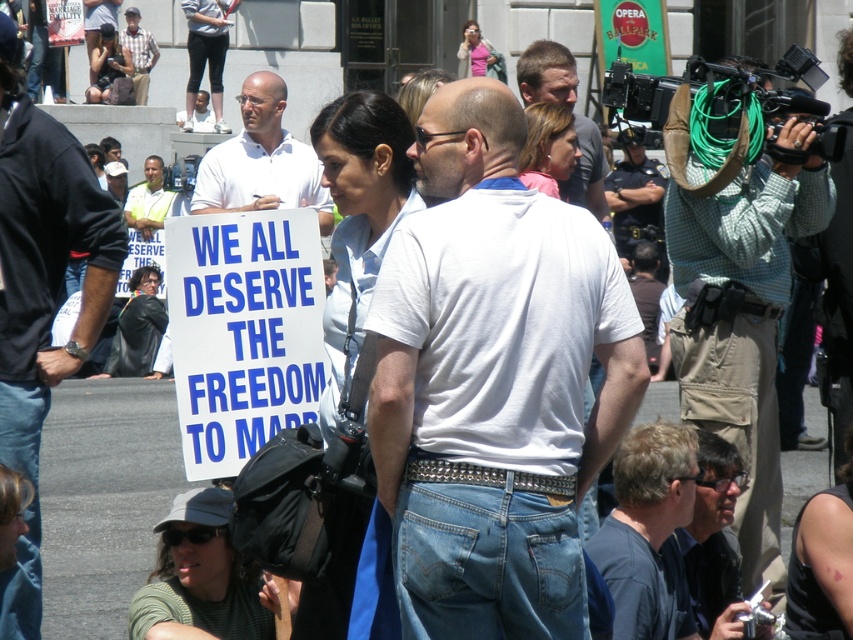
Question: Does light brown leather jacket at upper center have a lesser width compared to plaid shirt at upper left?

Choices:
 (A) yes
 (B) no

Answer: (B)

Question: Can you confirm if dark blue shirt at center is bigger than green corded camera at right?

Choices:
 (A) no
 (B) yes

Answer: (A)

Question: Is white matte shirt at center wider than plaid shirt at upper left?

Choices:
 (A) yes
 (B) no

Answer: (A)

Question: Which object is the closest to the yellow reflective vest at center?

Choices:
 (A) plaid shirt at upper left
 (B) green corded camera at right
 (C) dark blue shirt at center

Answer: (A)

Question: Which point appears closest to the camera in this image?

Choices:
 (A) (538, 74)
 (B) (689, 138)

Answer: (B)

Question: Which point is closer to the camera taking this photo?

Choices:
 (A) (564, 74)
 (B) (384, 481)

Answer: (B)